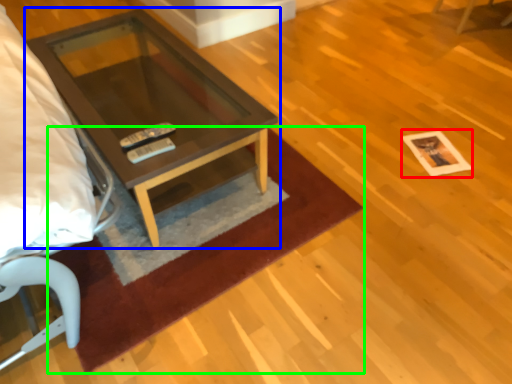
Question: Based on their relative distances, which object is farther from square (highlighted by a red box)? Choose from coffee table (highlighted by a blue box) and mat (highlighted by a green box).

Choices:
 (A) coffee table
 (B) mat

Answer: (A)